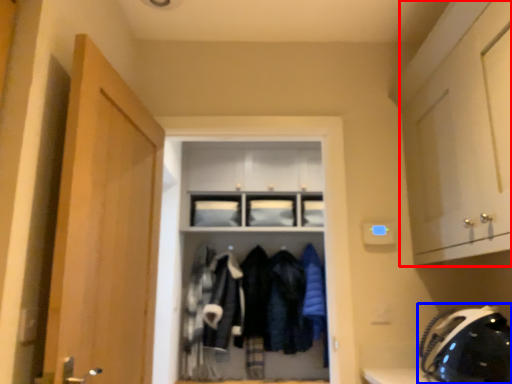
Question: Which point is closer to the camera, cabinetry (highlighted by a red box) or helmet (highlighted by a blue box)?

Choices:
 (A) cabinetry
 (B) helmet

Answer: (A)